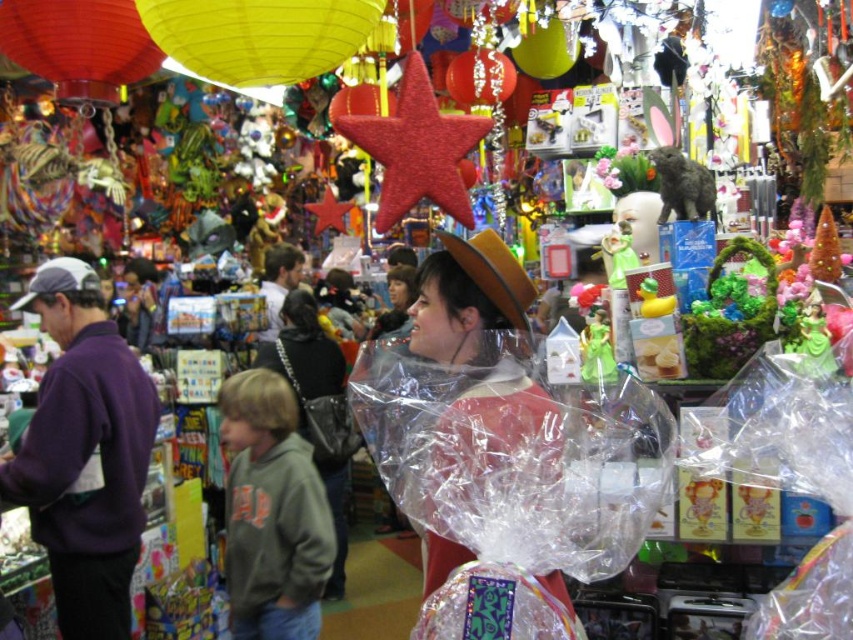
From the picture: Who is more distant from viewer, (132,541) or (447,243)?

The point (132,541) is more distant.

Is purple fleece sweatshirt at left shorter than matte brown hat at center?

No.

This screenshot has width=853, height=640. Identify the location of purple fleece sweatshirt at left. (84, 452).

I want to click on purple fleece sweatshirt at left, so click(84, 452).

Can you confirm if purple fleece sweatshirt at left is smaller than matte black purse at center?

Indeed, purple fleece sweatshirt at left has a smaller size compared to matte black purse at center.

Does point (55, 465) come closer to viewer compared to point (329, 349)?

Yes, point (55, 465) is closer to viewer.

The height and width of the screenshot is (640, 853). In order to click on purple fleece sweatshirt at left in this screenshot , I will do `click(84, 452)`.

Which is more to the left, matte brown hat at center or matte black purse at center?

From the viewer's perspective, matte black purse at center appears more on the left side.

Which is in front, point (486, 300) or point (341, 497)?

Point (486, 300) is in front.

Where is `matte brown hat at center`? The image size is (853, 640). matte brown hat at center is located at coordinates (466, 298).